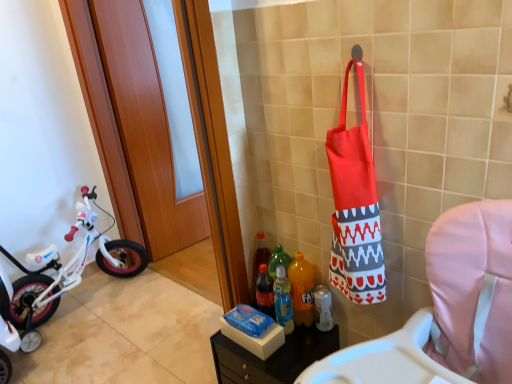
Question: In terms of size, does white matte bicycle at left appear bigger or smaller than red fabric tote bag at right?

Choices:
 (A) small
 (B) big

Answer: (B)

Question: Is point coord(29,317) closer or farther from the camera than point coord(331,283)?

Choices:
 (A) farther
 (B) closer

Answer: (A)

Question: Which is farther from the red fabric tote bag at right?

Choices:
 (A) white matte bicycle at left
 (B) orange plastic bottle at center, the second bottle in the left-to-right sequence
 (C) white plastic can at lower center, which is the first bottle from right to left
 (D) wooden at left
 (E) matte plastic tray at lower center

Answer: (A)

Question: Considering the real-world distances, which object is farthest from the white plastic can at lower center, which is the first bottle from right to left?

Choices:
 (A) fabric highchair at right
 (B) white matte bicycle at left
 (C) translucent plastic bottle at lower center, which is the 3th bottle from right to left
 (D) wooden at left
 (E) red fabric tote bag at right

Answer: (D)